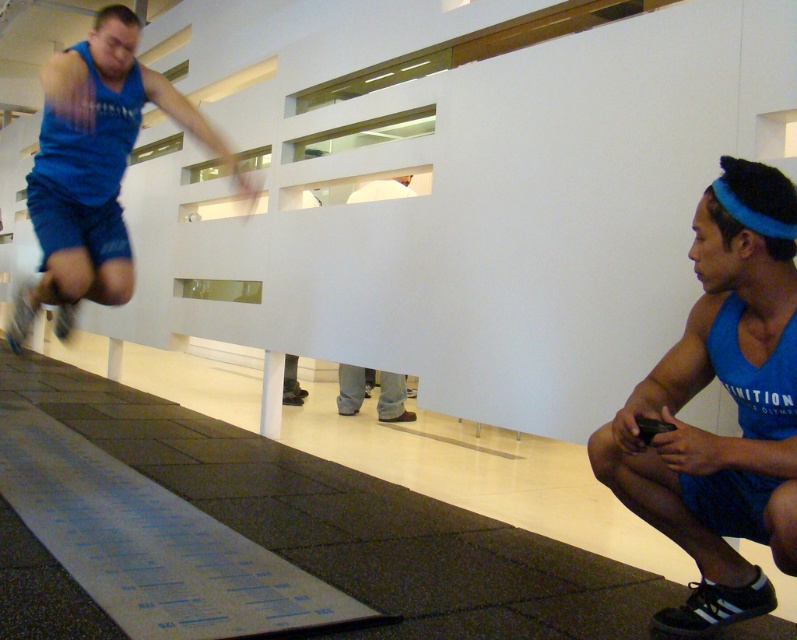
You are designing a clothing catalog and need to compare the width of the blue fabric tank top at lower right and the gray fabric pants at center. Which clothing item is narrower?

The blue fabric tank top at lower right is narrower than the gray fabric pants at center.

You are an athlete looking for your blue fabric tank top at left. According to the image, where exactly is it located?

The blue fabric tank top at left is located at point (93, 170).